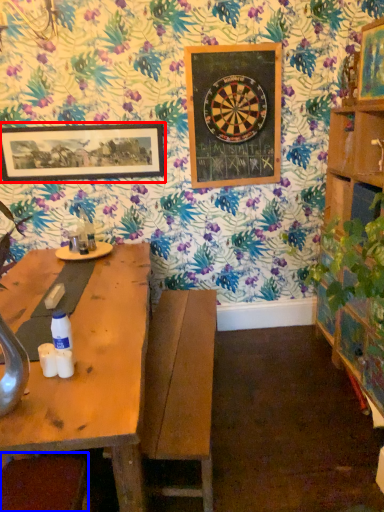
Question: Which object is closer to the camera taking this photo, picture frame (highlighted by a red box) or swivel chair (highlighted by a blue box)?

Choices:
 (A) picture frame
 (B) swivel chair

Answer: (B)